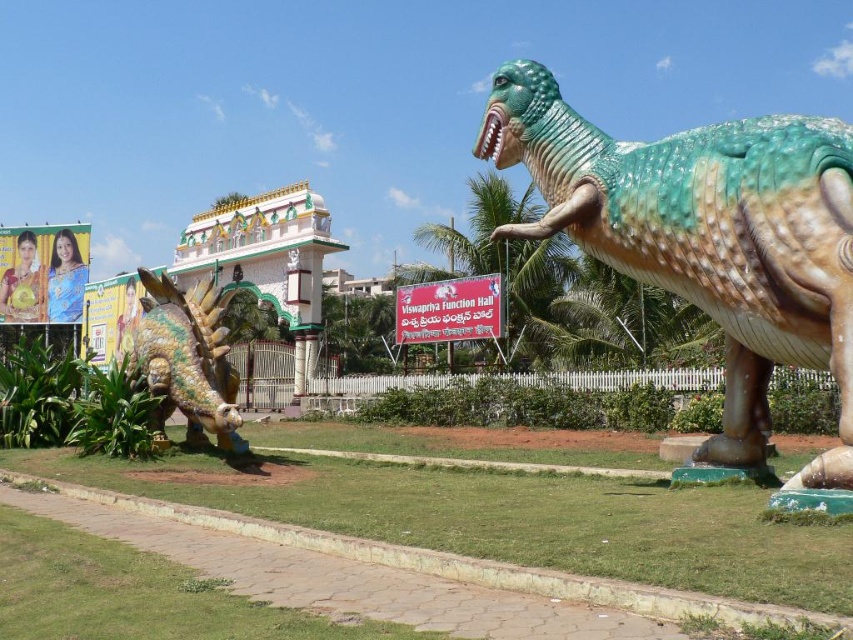
You are a photographer standing in front of the shiny green plastic dinosaur at right and the shiny gold plated dragon at center. You want to take a photo that captures both subjects clearly. Which dinosaur should you focus on first to ensure both are in focus?

You should focus on the shiny gold plated dragon at center first because it is farther away from the viewer than the shiny green plastic dinosaur at right, so focusing on the farther subject will help both be in focus.

You are standing in front of the shiny gold plated dragon at center and want to see the shiny green plastic dinosaur at right. Which direction should you look?

The shiny green plastic dinosaur at right is located below the shiny gold plated dragon at center, so you should look downward to see it.

You are standing in the outdoor scene and want to find the shiny green plastic dinosaur at right. Based on the coordinates provided, where should you look relative to the center of the image?

The shiny green plastic dinosaur at right is located at coordinates 0.372 on the x axis and 0.829 on the y axis, which places it slightly to the right and above the center of the image.